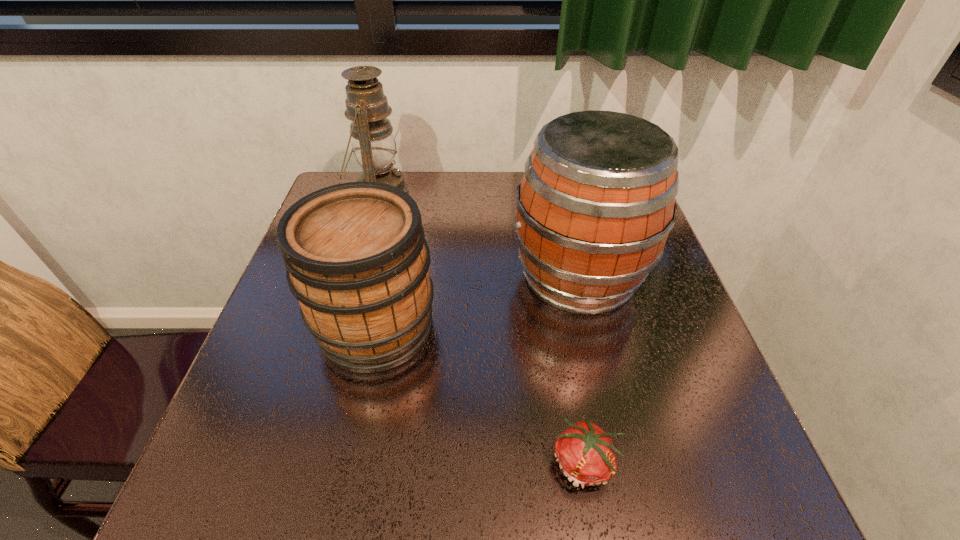
Locate an element on the screen. Image resolution: width=960 pixels, height=540 pixels. object situated at the far edge is located at coordinates (374, 146).

Image resolution: width=960 pixels, height=540 pixels. I want to click on object that is at the near edge, so click(x=586, y=455).

Identify the location of oil lamp that is at the left edge. The image size is (960, 540). click(374, 146).

Where is `cider present at the left edge`? Image resolution: width=960 pixels, height=540 pixels. cider present at the left edge is located at coordinates (357, 261).

Find the location of a particular element. This screenshot has width=960, height=540. object that is positioned at the right edge is located at coordinates coord(596,203).

Identify the location of object at the far left corner. (374, 146).

Identify the location of vacant space at the far edge of the desktop. (500, 176).

This screenshot has height=540, width=960. Find the location of `vacant region at the near edge`. vacant region at the near edge is located at coordinates (335, 515).

The width and height of the screenshot is (960, 540). Identify the location of vacant area at the left edge. (309, 386).

In the image, there is a desktop. Find the location of `vacant space at the right edge`. vacant space at the right edge is located at coordinates click(676, 368).